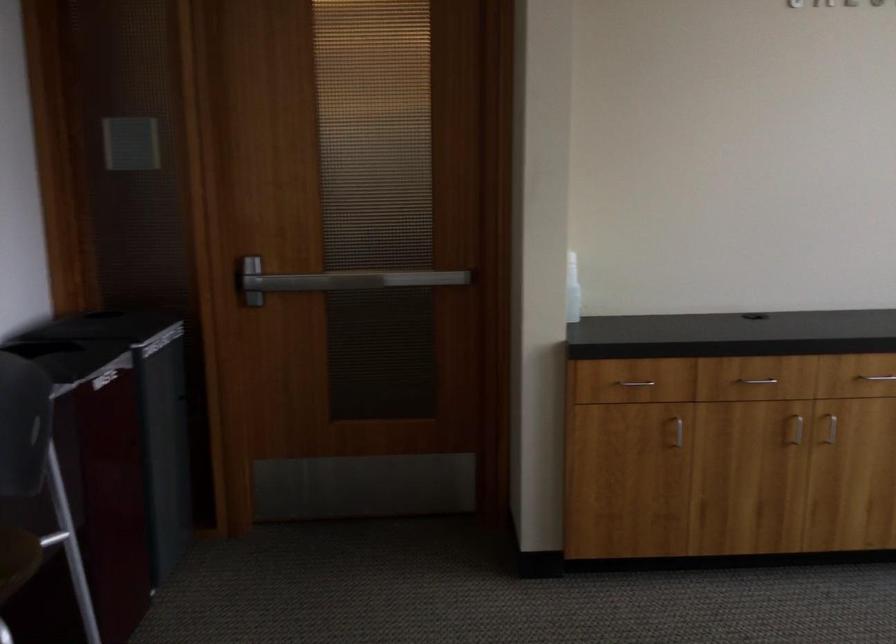
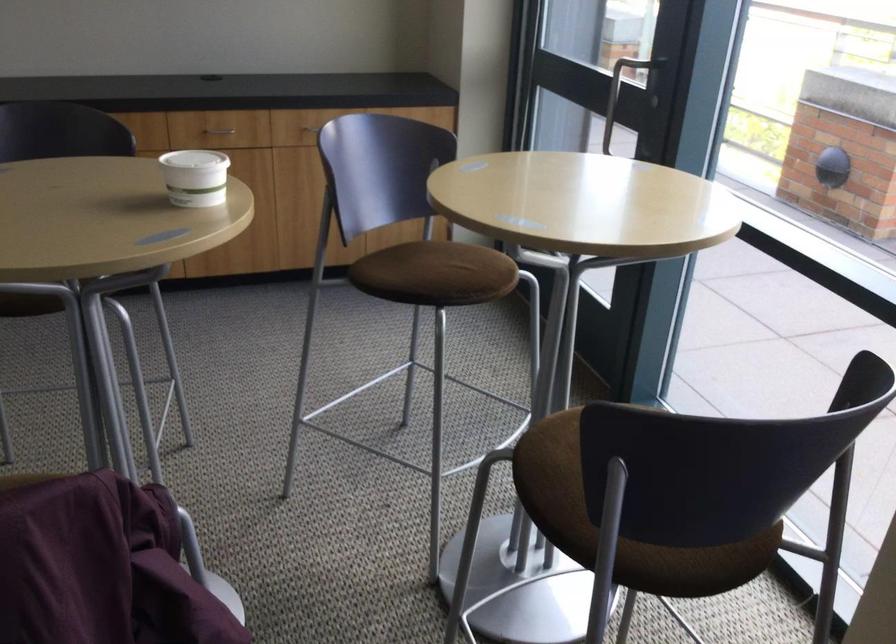
What movement of the cameraman would produce the second image?

The cameraman moved toward right, backward.